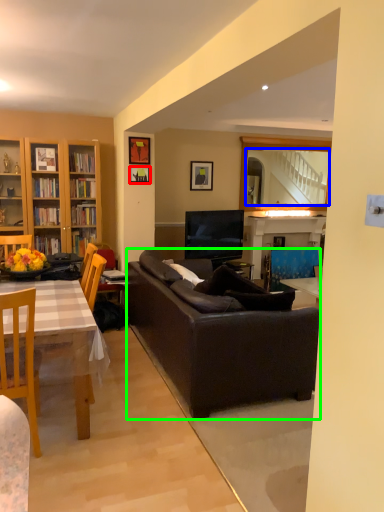
Question: Which object is positioned closest to picture frame (highlighted by a red box)? Select from mirror (highlighted by a blue box) and studio couch (highlighted by a green box).

Choices:
 (A) mirror
 (B) studio couch

Answer: (B)